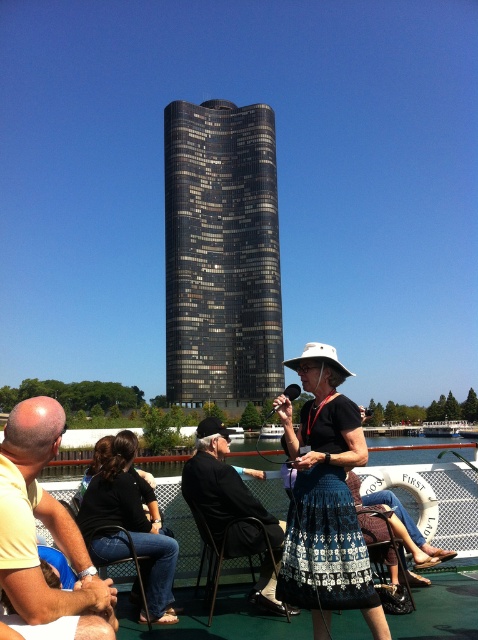
Is point (115, 522) behind point (122, 561)?

Yes, it is behind point (122, 561).

Can you confirm if black denim jeans at lower left is smaller than metallic black chair at lower left?

No, black denim jeans at lower left is not smaller than metallic black chair at lower left.

Is point (100, 468) less distant than point (117, 525)?

No.

Identify the location of black denim jeans at lower left. (130, 524).

Is yellow t-shirt at lower left above white mesh ferry at center?

Indeed, yellow t-shirt at lower left is positioned over white mesh ferry at center.

Which is behind, point (21, 515) or point (430, 429)?

The point (430, 429) is more distant.

Which is behind, point (14, 488) or point (459, 422)?

The point (459, 422) is behind.

The width and height of the screenshot is (478, 640). What are the coordinates of `yellow t-shirt at lower left` in the screenshot? It's located at (46, 525).

Does black glass building at center have a larger size compared to black leather jacket at center?

Yes.

Is black glass building at center smaller than black leather jacket at center?

No, black glass building at center is not smaller than black leather jacket at center.

Which is in front, point (225, 275) or point (272, 531)?

Point (272, 531)

This screenshot has width=478, height=640. What are the coordinates of `black glass building at center` in the screenshot? It's located at (220, 253).